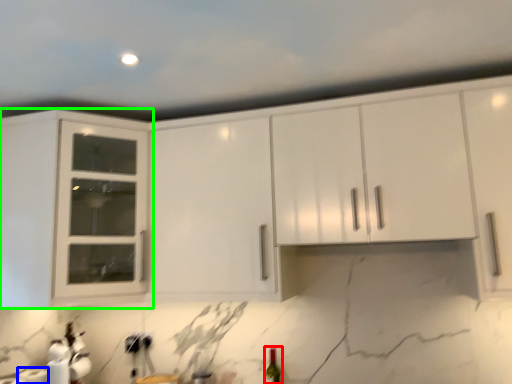
Question: Which object is positioned closest to wine bottle (highlighted by a red box)? Select from paper towel (highlighted by a blue box) and cabinetry (highlighted by a green box).

Choices:
 (A) paper towel
 (B) cabinetry

Answer: (A)